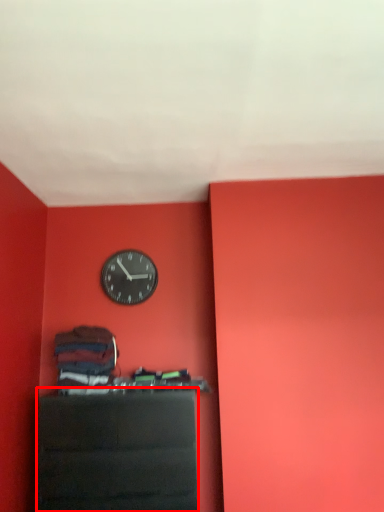
Question: In this image, where is furniture (annotated by the red box) located relative to wall clock?

Choices:
 (A) left
 (B) right

Answer: (B)